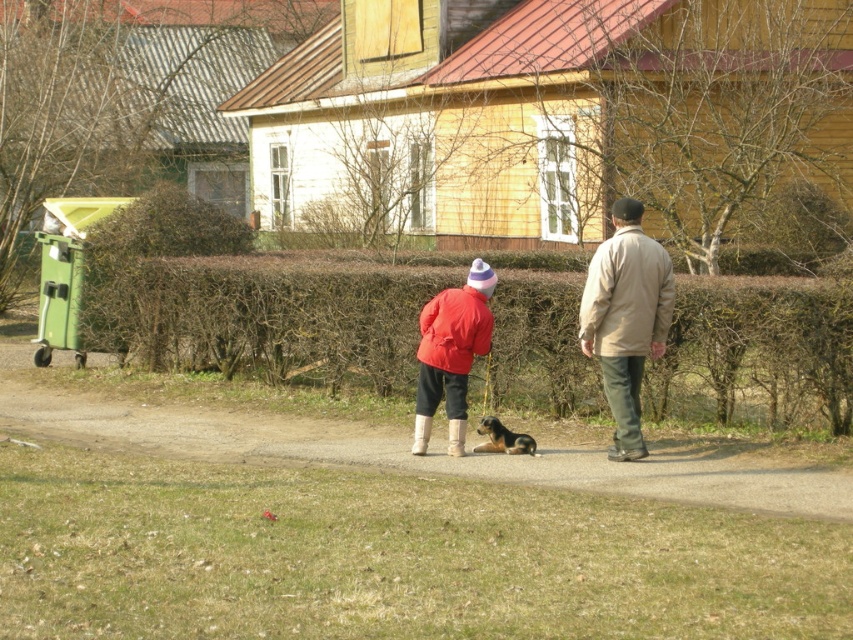
You are a gardener who needs to water the brown textured hedge at center and the dirt path at center. Which one should you water first if you want to avoid getting the dirt path wet?

You should water the brown textured hedge at center first because it is located above the dirt path at center, so watering it first would prevent water from dripping onto the dirt path and getting it wet.

You are standing on the paved path and want to approach the brown fur dog at center. Which direction should you move relative to the matte red jacket at center?

To approach the brown fur dog at center, you should move to the right of the matte red jacket at center since the matte red jacket at center is located to the left of the brown fur dog at center.

You are standing at point (488, 432) and want to walk to point (828, 513). Based on the scene, is the path between these two points clear of any obstacles?

Yes, the path between point (488, 432) and point (828, 513) is clear of obstacles as there are no objects blocking the way between them according to the scene description.